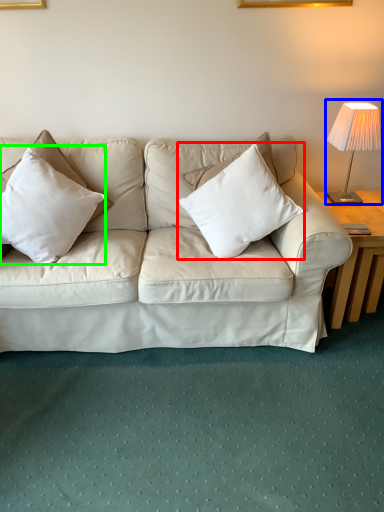
Question: Based on their relative distances, which object is farther from pillow (highlighted by a red box)? Choose from table lamp (highlighted by a blue box) and pillow (highlighted by a green box).

Choices:
 (A) table lamp
 (B) pillow

Answer: (B)